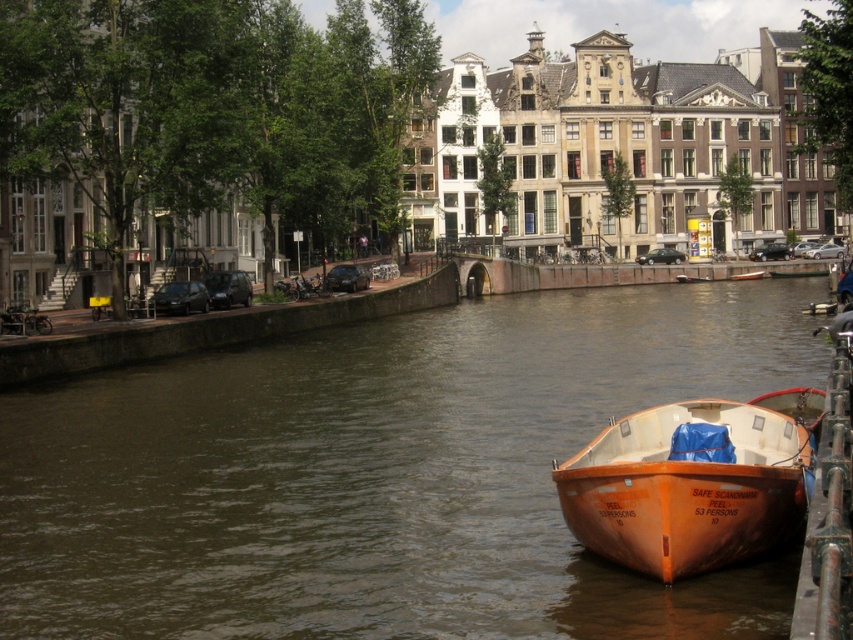
Question: Which of the following is the farthest from the observer?

Choices:
 (A) orange wood canoe at center
 (B) brown water at center
 (C) orange matte boat at lower right

Answer: (A)

Question: Is brown water at center positioned before orange matte boat at lower right?

Choices:
 (A) yes
 (B) no

Answer: (A)

Question: Is brown water at center below orange matte boat at lower right?

Choices:
 (A) yes
 (B) no

Answer: (B)

Question: Which object is farther from the camera taking this photo?

Choices:
 (A) brown water at center
 (B) orange wood canoe at center
 (C) orange matte boat at lower right

Answer: (B)

Question: Does brown water at center appear under orange wood canoe at center?

Choices:
 (A) no
 (B) yes

Answer: (B)

Question: Which object is the farthest from the orange wood canoe at center?

Choices:
 (A) brown water at center
 (B) orange matte boat at lower right

Answer: (B)